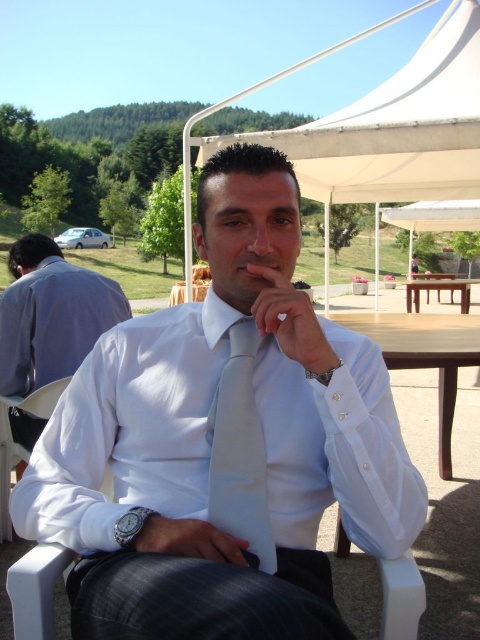
Question: Which point is closer to the camera taking this photo?

Choices:
 (A) (478, 278)
 (B) (432, 339)

Answer: (B)

Question: Does light blue silk tie at center have a smaller size compared to wooden table at center?

Choices:
 (A) no
 (B) yes

Answer: (B)

Question: Estimate the real-world distances between objects in this image. Which object is closer to the light blue silk tie at center?

Choices:
 (A) wooden table at center
 (B) white matte shirt at center
 (C) matte gray shirt at left

Answer: (B)

Question: From the image, what is the correct spatial relationship of white matte shirt at center in relation to matte gray shirt at left?

Choices:
 (A) left
 (B) right

Answer: (B)

Question: Is white matte shirt at center to the right of brown wooden picnic table at center from the viewer's perspective?

Choices:
 (A) no
 (B) yes

Answer: (A)

Question: Among these objects, which one is farthest from the camera?

Choices:
 (A) white matte shirt at center
 (B) brown wooden picnic table at center
 (C) wooden table at center
 (D) light blue silk tie at center

Answer: (B)